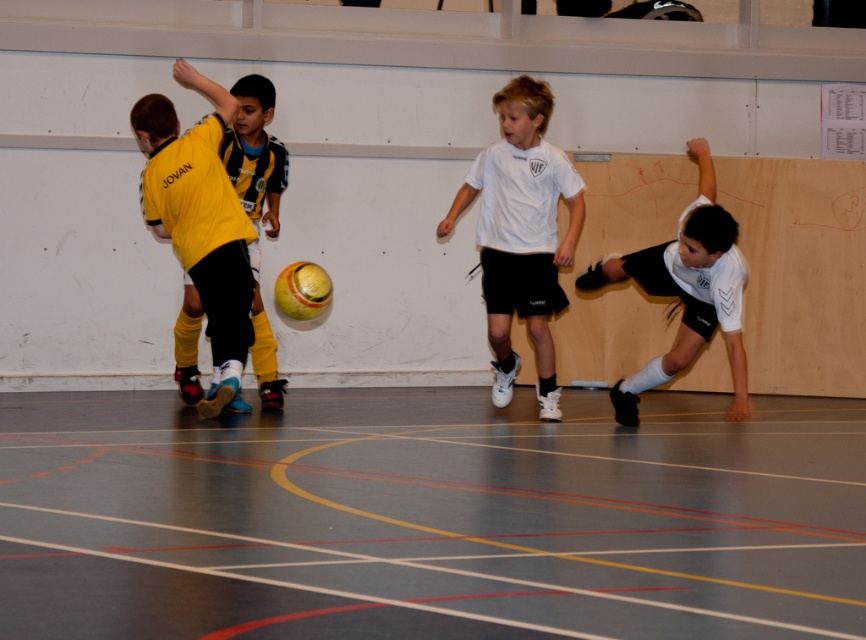
Is white matte shirt at center taller than white matte shorts at right?

Indeed, white matte shirt at center has a greater height compared to white matte shorts at right.

Which is behind, point (573, 248) or point (742, 372)?

Positioned behind is point (573, 248).

This screenshot has height=640, width=866. Find the location of `white matte shirt at center`. white matte shirt at center is located at coordinates (521, 234).

I want to click on white matte shirt at center, so click(x=521, y=234).

Who is more forward, [233,232] or [653,264]?

Positioned in front is point [233,232].

This screenshot has width=866, height=640. What do you see at coordinates (199, 221) in the screenshot?
I see `yellow matte jersey at left` at bounding box center [199, 221].

What do you see at coordinates (199, 221) in the screenshot? This screenshot has width=866, height=640. I see `yellow matte jersey at left` at bounding box center [199, 221].

At what (x,y) coordinates should I click in order to perform the action: click on yellow matte jersey at left. Please return your answer as a coordinate pair (x, y). Image resolution: width=866 pixels, height=640 pixels. Looking at the image, I should click on (199, 221).

Who is shorter, smooth gray floor at center or white matte shirt at center?

smooth gray floor at center is shorter.

Who is taller, smooth gray floor at center or white matte shirt at center?

white matte shirt at center

This screenshot has width=866, height=640. What do you see at coordinates (430, 516) in the screenshot?
I see `smooth gray floor at center` at bounding box center [430, 516].

At what (x,y) coordinates should I click in order to perform the action: click on smooth gray floor at center. Please return your answer as a coordinate pair (x, y). Looking at the image, I should click on (430, 516).